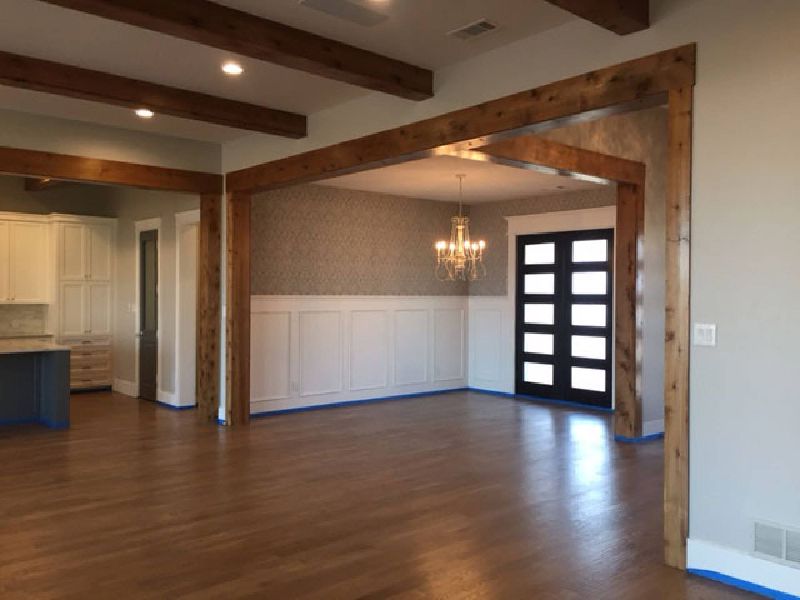
You are a GUI agent. You are given a task and a screenshot of the screen. Output one action in this format:
    pyautogui.click(x=<x>, y=<y>)
    Task: Click on the wall
    
    Given the screenshot: What is the action you would take?
    pyautogui.click(x=360, y=289), pyautogui.click(x=796, y=350)